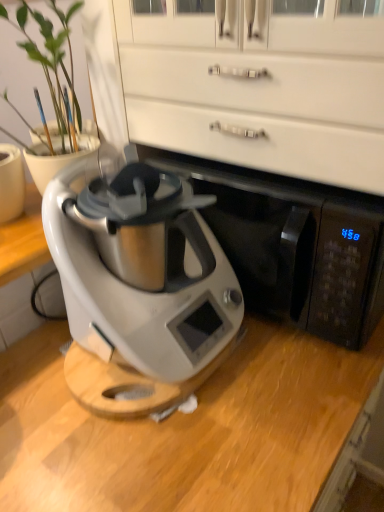
In order to face satin silver appliance at center, should I rotate leftwards or rightwards?

Turn right by 10.883 degrees to look at satin silver appliance at center.

Where is `satin silver appliance at center`? The width and height of the screenshot is (384, 512). satin silver appliance at center is located at coordinates (139, 289).

The image size is (384, 512). Identify the location of matte white vase at left. (53, 85).

Which is correct: white glossy dresser at upper center is inside matte white vase at left, or outside of it?

The correct answer is: outside.

Does white glossy dresser at upper center lie behind matte white vase at left?

No, white glossy dresser at upper center is closer to the camera.

Who is smaller, white glossy dresser at upper center or matte white vase at left?

Result: With smaller size is matte white vase at left.

Considering the sizes of satin silver appliance at center and satin silver appliance at center in the image, is satin silver appliance at center taller or shorter than satin silver appliance at center?

Considering their sizes, satin silver appliance at center has less height than satin silver appliance at center.

Measure the distance between satin silver appliance at center and satin silver appliance at center.

satin silver appliance at center and satin silver appliance at center are 7.32 inches apart from each other.

From a real-world perspective, does satin silver appliance at center sit lower than satin silver appliance at center?

Yes, from a real-world perspective, satin silver appliance at center is under satin silver appliance at center.

Is satin silver appliance at center aimed at satin silver appliance at center?

Yes, satin silver appliance at center is oriented towards satin silver appliance at center.

Can satin silver appliance at center be found inside matte white vase at left?

Actually, satin silver appliance at center is outside matte white vase at left.

Between matte white vase at left and satin silver appliance at center, which one appears on the left side from the viewer's perspective?

matte white vase at left.

Which is behind, point (67, 37) or point (286, 253)?

Positioned behind is point (67, 37).

Considering the sizes of objects matte white vase at left and satin silver appliance at center in the image provided, who is thinner, matte white vase at left or satin silver appliance at center?

Thinner between the two is matte white vase at left.

Which object is thinner, satin silver appliance at center or matte white vase at left?

matte white vase at left.

Is satin silver appliance at center bigger or smaller than matte white vase at left?

satin silver appliance at center is bigger than matte white vase at left.

From a real-world perspective, which object stands above the other?

matte white vase at left.

Who is taller, satin silver appliance at center or white glossy dresser at upper center?

white glossy dresser at upper center is taller.

Based on the photo, who is smaller, satin silver appliance at center or white glossy dresser at upper center?

With smaller size is white glossy dresser at upper center.

From the image's perspective, is satin silver appliance at center on white glossy dresser at upper center?

No, from the image's perspective, satin silver appliance at center is not above white glossy dresser at upper center.

Considering the sizes of objects satin silver appliance at center and white glossy dresser at upper center in the image provided, who is wider, satin silver appliance at center or white glossy dresser at upper center?

With larger width is satin silver appliance at center.

In the image, there is a satin silver appliance at center. Find the location of `dresser above it (from the image's perspective)`. dresser above it (from the image's perspective) is located at coordinates (259, 89).

Is white glossy dresser at upper center not near satin silver appliance at center?

No.

Could you tell me if white glossy dresser at upper center is turned towards satin silver appliance at center?

No, white glossy dresser at upper center does not turn towards satin silver appliance at center.

Is the depth of satin silver appliance at center less than that of satin silver appliance at center?

Yes, satin silver appliance at center is closer to the camera.

Considering the sizes of satin silver appliance at center and satin silver appliance at center in the image, is satin silver appliance at center taller or shorter than satin silver appliance at center?

satin silver appliance at center is taller than satin silver appliance at center.

Is satin silver appliance at center wider than satin silver appliance at center?

No, satin silver appliance at center is not wider than satin silver appliance at center.

Can you see satin silver appliance at center touching satin silver appliance at center?

They are not placed beside each other.

Where is `dresser on the right of matte white vase at left`? dresser on the right of matte white vase at left is located at coordinates (259, 89).

At what (x,y) coordinates should I click in order to perform the action: click on home appliance below the satin silver appliance at center (from the image's perspective). Please return your answer as a coordinate pair (x, y). The height and width of the screenshot is (512, 384). Looking at the image, I should click on (139, 289).

From the image, which object appears to be nearer to satin silver appliance at center, matte white vase at left or satin silver appliance at center?

satin silver appliance at center is positioned closer to the anchor satin silver appliance at center.

Which object lies nearer to the anchor point satin silver appliance at center, satin silver appliance at center or white glossy dresser at upper center?

The object closer to satin silver appliance at center is satin silver appliance at center.

When comparing their distances from satin silver appliance at center, does matte white vase at left or white glossy dresser at upper center seem closer?

white glossy dresser at upper center is closer to satin silver appliance at center.

Looking at the image, which one is located closer to satin silver appliance at center, satin silver appliance at center or matte white vase at left?

The object closer to satin silver appliance at center is satin silver appliance at center.

From the image, which object appears to be farther from matte white vase at left, satin silver appliance at center or satin silver appliance at center?

satin silver appliance at center lies further to matte white vase at left than the other object.

Estimate the real-world distances between objects in this image. Which object is further from satin silver appliance at center, white glossy dresser at upper center or matte white vase at left?

The object further to satin silver appliance at center is white glossy dresser at upper center.

When comparing their distances from satin silver appliance at center, does white glossy dresser at upper center or matte white vase at left seem further?

Among the two, matte white vase at left is located further to satin silver appliance at center.

Considering their positions, is matte white vase at left positioned further to white glossy dresser at upper center than satin silver appliance at center?

Among the two, matte white vase at left is located further to white glossy dresser at upper center.

The height and width of the screenshot is (512, 384). What are the coordinates of `home appliance between matte white vase at left and satin silver appliance at center from left to right` in the screenshot? It's located at (139, 289).

Image resolution: width=384 pixels, height=512 pixels. I want to click on home appliance between matte white vase at left and white glossy dresser at upper center, so click(139, 289).

The height and width of the screenshot is (512, 384). Find the location of `dresser between matte white vase at left and satin silver appliance at center`. dresser between matte white vase at left and satin silver appliance at center is located at coordinates (259, 89).

This screenshot has height=512, width=384. I want to click on dresser located between satin silver appliance at center and satin silver appliance at center in the left-right direction, so click(x=259, y=89).